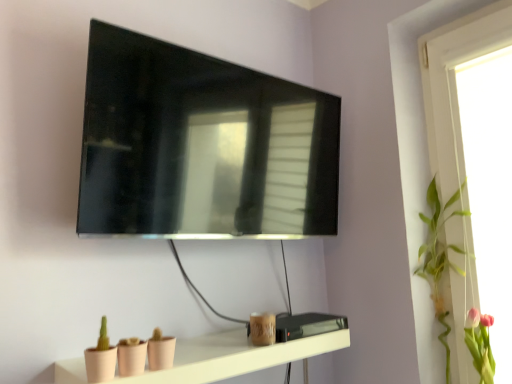
Question: Is point (176, 56) closer or farther from the camera than point (432, 241)?

Choices:
 (A) farther
 (B) closer

Answer: (B)

Question: Is matte black tv at upper center taller or shorter than green leafy plant at upper right?

Choices:
 (A) tall
 (B) short

Answer: (A)

Question: Estimate the real-world distances between objects in this image. Which object is closer to the pink silk flower at upper right?

Choices:
 (A) matte pink shelf at lower center
 (B) matte black tv at upper center
 (C) green leafy plant at upper right

Answer: (C)

Question: Estimate the real-world distances between objects in this image. Which object is farther from the green leafy plant at upper right?

Choices:
 (A) matte pink shelf at lower center
 (B) matte black tv at upper center
 (C) pink silk flower at upper right

Answer: (B)